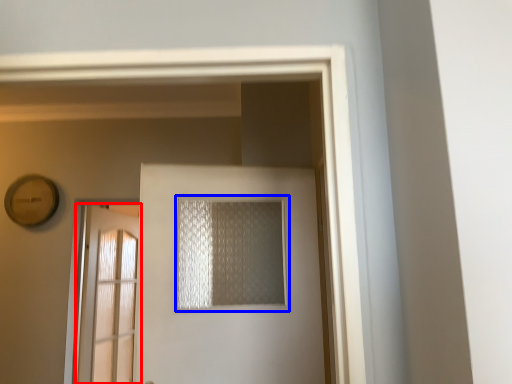
Question: Among these objects, which one is farthest to the camera, door (highlighted by a red box) or window (highlighted by a blue box)?

Choices:
 (A) door
 (B) window

Answer: (A)